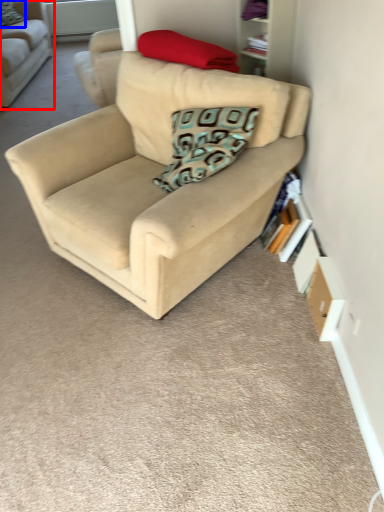
Question: Which object appears farthest to the camera in this image, studio couch (highlighted by a red box) or pillow (highlighted by a blue box)?

Choices:
 (A) studio couch
 (B) pillow

Answer: (B)